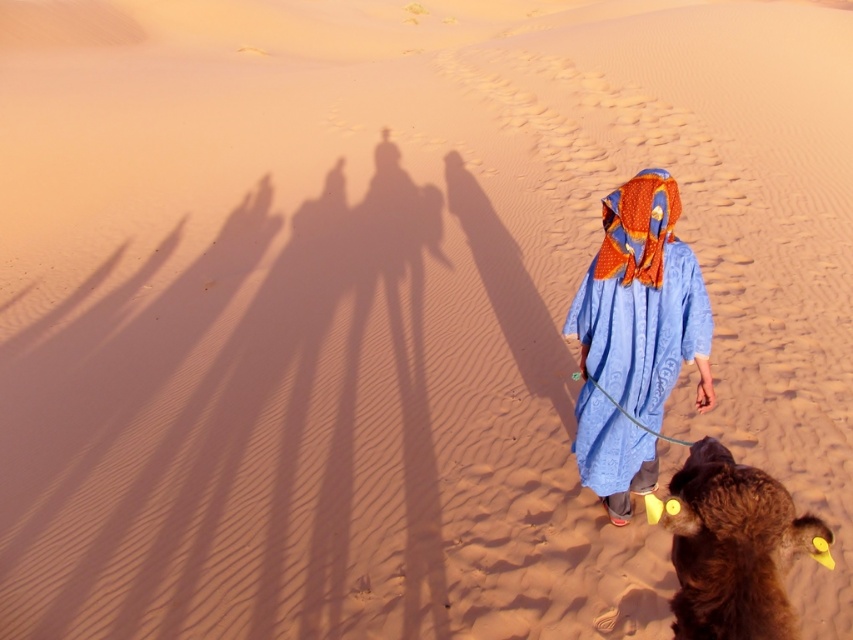
You are a traveler in the desert and see the blue woven fabric at center and the brown fuzzy camel at lower right. Which object is closer to you?

The blue woven fabric at center is closer to you because the brown fuzzy camel at lower right is behind it.

You are standing in the desert scene and want to move from the point closer to you to the point farther away. Which path should you take between the two points, point (643, 342) and point (801, 525)?

You should move from point (643, 342) to point (801, 525) because point (643, 342) is closer to you and point (801, 525) is farther away.

Based on the scene description, where is the blue woven fabric at center located in the image?

The blue woven fabric at center is located at point (642, 301).